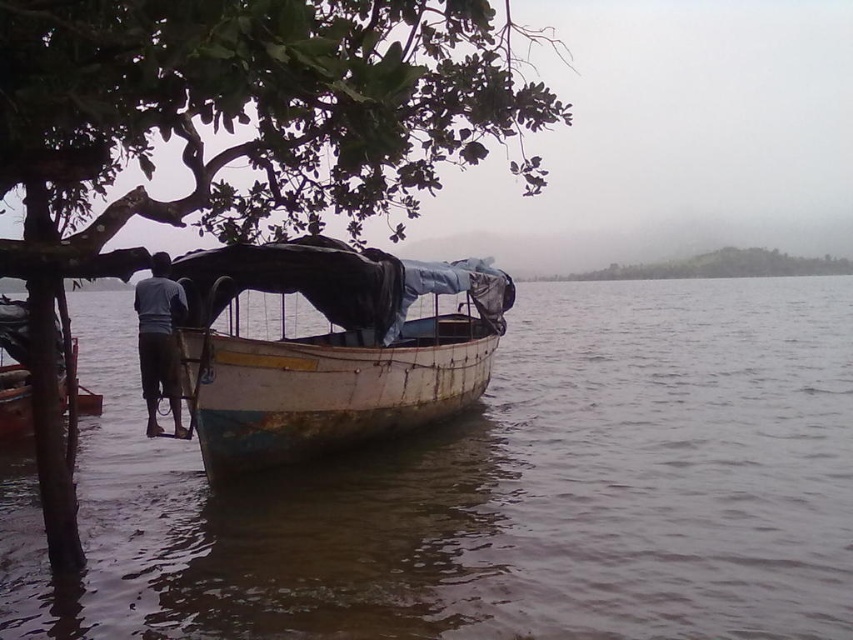
You are an observer looking at the riverside scene. You notice the green leafy tree at upper left and the dark blue fabric at left. Which object appears bigger in the image?

The green leafy tree at upper left appears bigger than the dark blue fabric at left because it has a larger size compared to it.

You are planning to take a short boat ride on the wooden boat at center. However, you notice a green leafy tree at upper center nearby. Considering their sizes, which object would you say is taller?

The green leafy tree at upper center is taller than the wooden boat at center.

Based on the scene description, what are the coordinates of the wooden boat at center in the image?

The wooden boat at center is located at coordinates (329, 348).